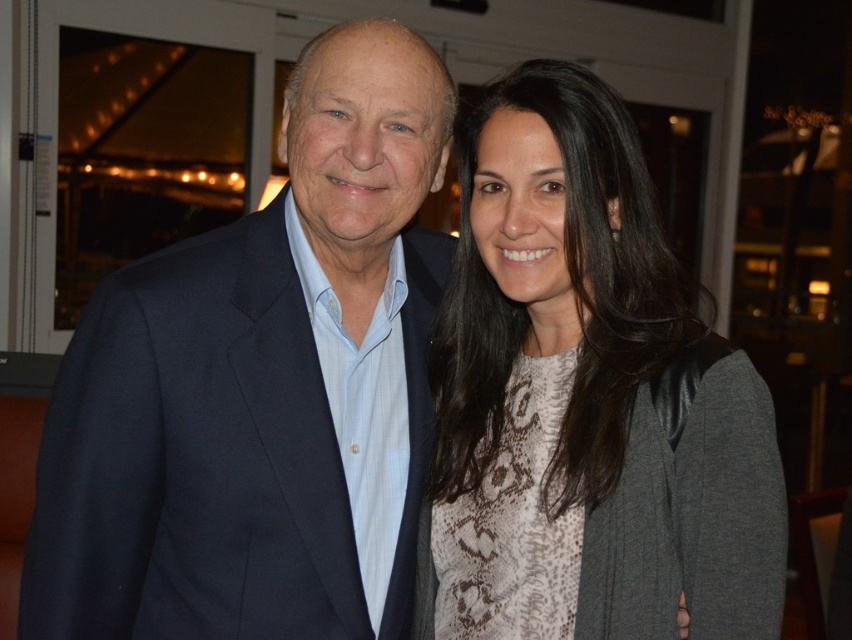
Question: Which point is farther to the camera?

Choices:
 (A) navy blue suit at left
 (B) snake print sweater at center

Answer: (A)

Question: Observing the image, what is the correct spatial positioning of navy blue suit at left in reference to snake print sweater at center?

Choices:
 (A) right
 (B) left

Answer: (B)

Question: Which point is closer to the camera?

Choices:
 (A) navy blue suit at left
 (B) snake print sweater at center

Answer: (B)

Question: Is navy blue suit at left positioned at the back of snake print sweater at center?

Choices:
 (A) yes
 (B) no

Answer: (A)

Question: Observing the image, what is the correct spatial positioning of navy blue suit at left in reference to snake print sweater at center?

Choices:
 (A) below
 (B) above

Answer: (A)